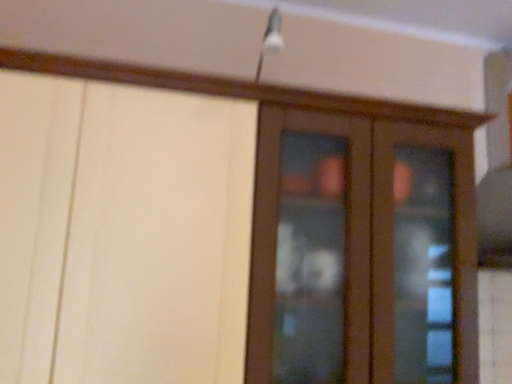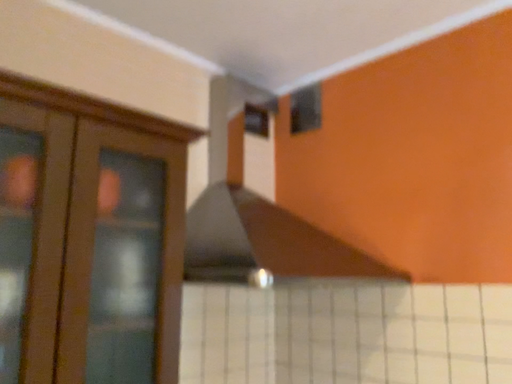
Question: Which way did the camera rotate in the video?

Choices:
 (A) rotated left
 (B) rotated right

Answer: (B)